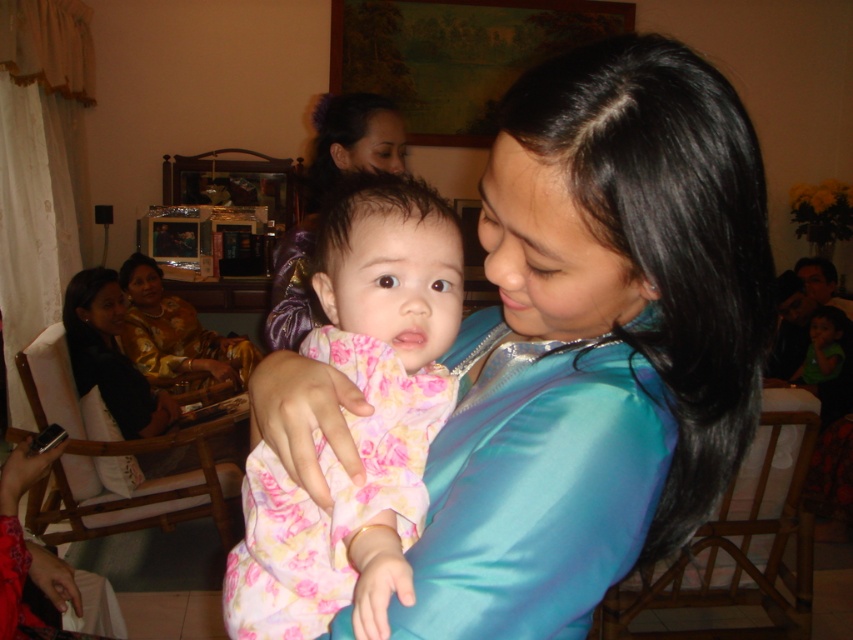
You are a photographer setting up a shoot in this room. You need to position a spotlight to highlight both the teal satin dress at center and the matte purple hair at center. Since the spotlight can only illuminate one area at a time, which object should you illuminate first to ensure the other is still visible in the frame?

The teal satin dress at center is below matte purple hair at center, so you should illuminate the matte purple hair at center first. This way, the lower positioned teal satin dress at center will still be visible in the frame without being overly shadowed.

You are a photographer setting up for a family photo. You notice the pink floral dress at center and the gold satin dress at left in the scene. Which dress should you adjust to ensure both are fully visible in the frame?

The pink floral dress at center has a lesser height compared to the gold satin dress at left, so you should adjust the pink floral dress at center to ensure both are fully visible in the frame.